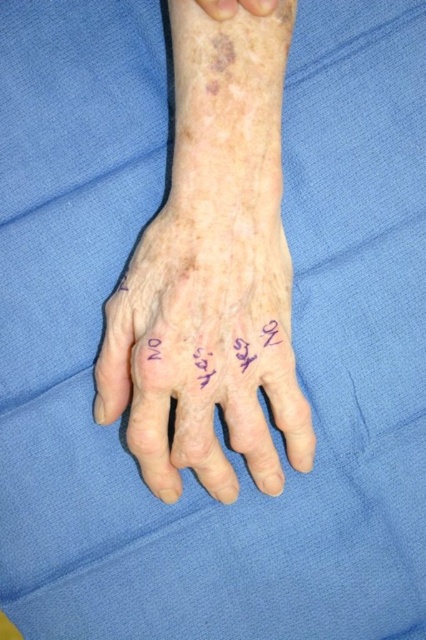
You are a nurse checking the medical chart of a patient. You see the dry skin hand at center and the purple ink writing at center. Which object is located to the left?

The dry skin hand at center is positioned on the left side of purple ink writing at center.